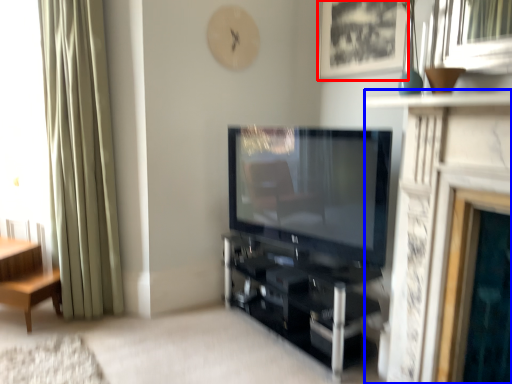
Question: Which of the following is the farthest to the observer, picture frame (highlighted by a red box) or fireplace (highlighted by a blue box)?

Choices:
 (A) picture frame
 (B) fireplace

Answer: (A)